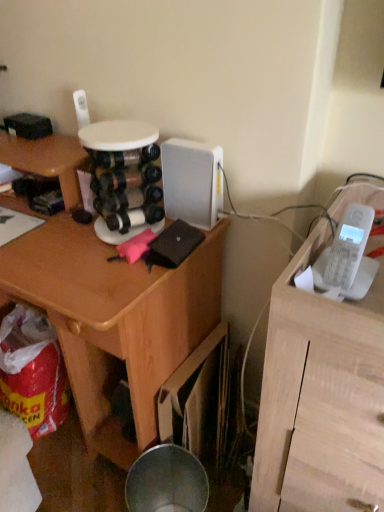
What do you see at coordinates (321, 397) in the screenshot? I see `white matte telephone at upper right` at bounding box center [321, 397].

Describe the element at coordinates (348, 246) in the screenshot. I see `white plastic phone at right` at that location.

Identify the location of white matte telephone at upper right. (321, 397).

Is white matte telephone at upper right situated inside wooden desk at center or outside?

white matte telephone at upper right is outside wooden desk at center.

Who is more distant, white matte telephone at upper right or wooden desk at center?

wooden desk at center is further from the camera.

Between white matte telephone at upper right and wooden desk at center, which one appears on the left side from the viewer's perspective?

From the viewer's perspective, wooden desk at center appears more on the left side.

Considering the relative sizes of white matte telephone at upper right and wooden desk at center in the image provided, is white matte telephone at upper right wider than wooden desk at center?

Yes, white matte telephone at upper right is wider than wooden desk at center.

From a real-world perspective, does white matte telephone at upper right sit lower than white plastic phone at right?

Correct, in the physical world, white matte telephone at upper right is lower than white plastic phone at right.

How many degrees apart are the facing directions of white matte telephone at upper right and white plastic phone at right?

5.96 degrees separate the facing orientations of white matte telephone at upper right and white plastic phone at right.

Looking at this image, is white plastic phone at right at the back of white matte telephone at upper right?

No, white matte telephone at upper right is not facing the opposite direction of white plastic phone at right.

Is white matte telephone at upper right positioned behind white plastic phone at right?

That is False.

Looking at this image, is white plastic phone at right shorter than white matte telephone at upper right?

Indeed, white plastic phone at right has a lesser height compared to white matte telephone at upper right.

From a real-world perspective, is white plastic phone at right located higher than white matte telephone at upper right?

Yes, from a real-world perspective, white plastic phone at right is on top of white matte telephone at upper right.

Is white plastic phone at right facing away from white matte telephone at upper right?

No, white plastic phone at right is not facing the opposite direction of white matte telephone at upper right.

From the picture: Is the surface of white plastic phone at right in direct contact with white matte telephone at upper right?

No, white plastic phone at right is not making contact with white matte telephone at upper right.

From a real-world perspective, is wooden desk at center under white matte telephone at upper right?

Yes.

Can you confirm if wooden desk at center is wider than white matte telephone at upper right?

Incorrect, the width of wooden desk at center does not surpass that of white matte telephone at upper right.

Where is `furniture below the wooden desk at center (from the image's perspective)`? The image size is (384, 512). furniture below the wooden desk at center (from the image's perspective) is located at coordinates click(321, 397).

How many degrees apart are the facing directions of wooden desk at center and white matte telephone at upper right?

wooden desk at center and white matte telephone at upper right are facing 1.69 degrees away from each other.

Is white plastic phone at right taller or shorter than wooden desk at center?

Clearly, white plastic phone at right is shorter compared to wooden desk at center.

The image size is (384, 512). What are the coordinates of `ipod on the right of wooden desk at center` in the screenshot? It's located at (348, 246).

From a real-world perspective, is white plastic phone at right positioned under wooden desk at center based on gravity?

Incorrect, from a real-world perspective, white plastic phone at right is higher than wooden desk at center.

Would you say wooden desk at center is a long distance from white plastic phone at right?

That's not correct — wooden desk at center is a little close to white plastic phone at right.

Considering the relative sizes of wooden desk at center and white plastic phone at right in the image provided, is wooden desk at center shorter than white plastic phone at right?

No, wooden desk at center is not shorter than white plastic phone at right.

Consider the image. How many degrees apart are the facing directions of wooden desk at center and white plastic phone at right?

They differ by 4.27 degrees in their facing directions.

In the image, is wooden desk at center positioned in front of or behind white plastic phone at right?

Visually, wooden desk at center is located behind white plastic phone at right.

At what (x,y) coordinates should I click in order to perform the action: click on furniture that appears on the right of wooden desk at center. Please return your answer as a coordinate pair (x, y). This screenshot has height=512, width=384. Looking at the image, I should click on (321, 397).

The image size is (384, 512). Identify the location of furniture located underneath the white plastic phone at right (from a real-world perspective). (321, 397).

Estimate the real-world distances between objects in this image. Which object is closer to white matte telephone at upper right, white plastic phone at right or wooden desk at center?

The object closer to white matte telephone at upper right is white plastic phone at right.

Estimate the real-world distances between objects in this image. Which object is closer to white plastic phone at right, white matte telephone at upper right or wooden desk at center?

The object closer to white plastic phone at right is white matte telephone at upper right.

Which object lies nearer to the anchor point white matte telephone at upper right, wooden desk at center or white plastic phone at right?

Based on the image, white plastic phone at right appears to be nearer to white matte telephone at upper right.

Looking at the image, which one is located further to wooden desk at center, white plastic phone at right or white matte telephone at upper right?

Based on the image, white plastic phone at right appears to be further to wooden desk at center.

From the image, which object appears to be farther from wooden desk at center, white matte telephone at upper right or white plastic phone at right?

Among the two, white plastic phone at right is located further to wooden desk at center.

Estimate the real-world distances between objects in this image. Which object is closer to white plastic phone at right, wooden desk at center or white matte telephone at upper right?

Result: white matte telephone at upper right lies closer to white plastic phone at right than the other object.

You are a GUI agent. You are given a task and a screenshot of the screen. Output one action in this format:
    pyautogui.click(x=<x>, y=<y>)
    Task: Click on the ipod located between wooden desk at center and white matte telephone at upper right in the left-right direction
    Image resolution: width=384 pixels, height=512 pixels.
    Given the screenshot: What is the action you would take?
    coord(348,246)